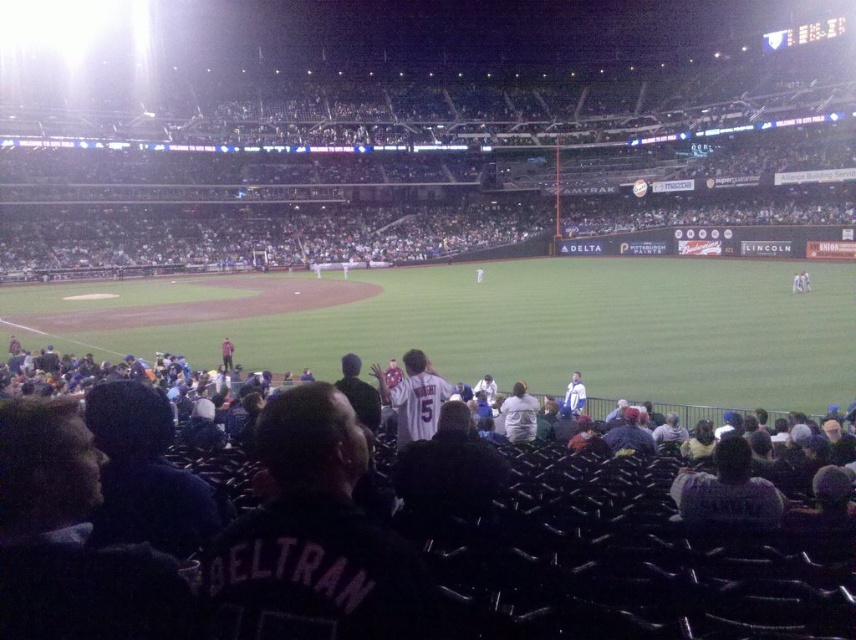
You are a photographer at the baseball stadium and want to take a photo of the dark gray jacket at center and the white jersey at center. Which one is on the right side when looking at the scene?

The dark gray jacket at center is positioned on the right side of white jersey at center, so the dark gray jacket at center is on the right side.

You are a spectator at the baseball stadium and you want to find the dark gray jacket at center. Where exactly is it located in the image?

The dark gray jacket at center is located at point coordinates of (727, 492).